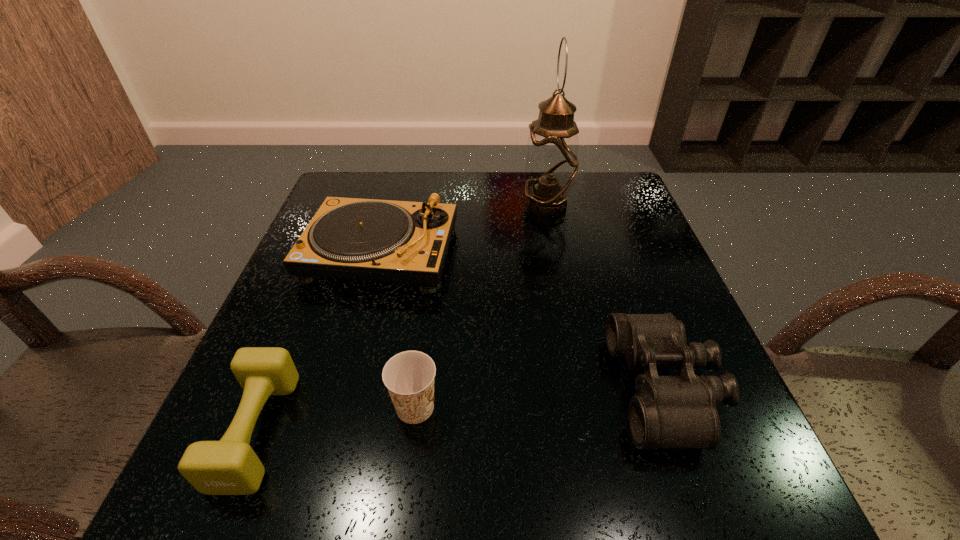
Locate an element on the screen. The image size is (960, 540). free space located 0.080m on the back of the Dixie cup is located at coordinates (422, 350).

I want to click on vacant space situated on the back of the dumbbell, so click(310, 297).

Locate an element on the screen. The height and width of the screenshot is (540, 960). oil lamp located at the far edge is located at coordinates (551, 164).

This screenshot has height=540, width=960. I want to click on record player that is at the far edge, so point(403,242).

Where is `binoculars present at the near edge`? The height and width of the screenshot is (540, 960). binoculars present at the near edge is located at coordinates (680, 411).

This screenshot has width=960, height=540. Find the location of `dumbbell that is at the near edge`. dumbbell that is at the near edge is located at coordinates (230, 466).

Find the location of a particular element. This screenshot has width=960, height=540. record player that is positioned at the left edge is located at coordinates (403, 242).

Identify the location of dumbbell situated at the left edge. This screenshot has width=960, height=540. (230, 466).

Where is `object that is positioned at the right edge`? This screenshot has height=540, width=960. object that is positioned at the right edge is located at coordinates (680, 411).

Find the location of a particular element. Image resolution: width=960 pixels, height=540 pixels. object at the far left corner is located at coordinates (403, 242).